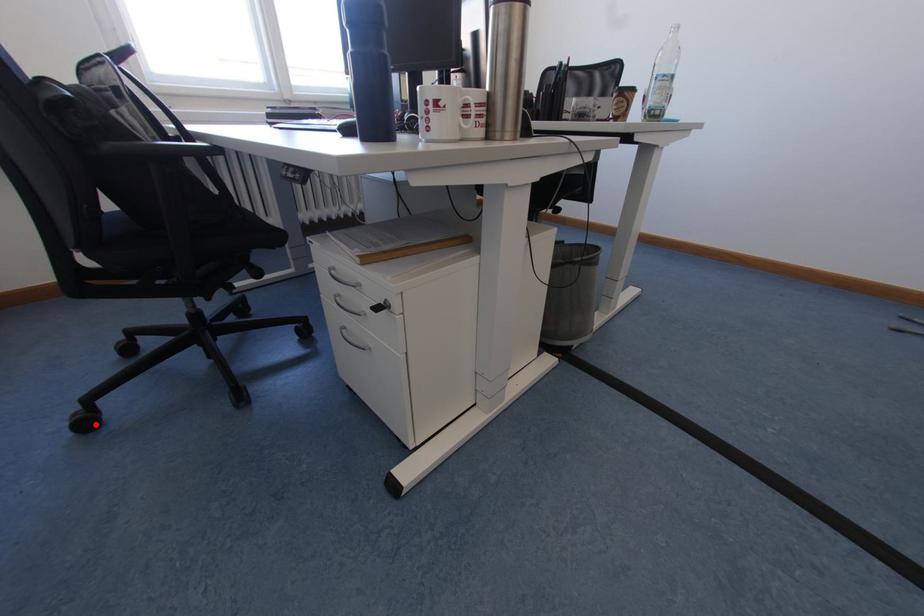
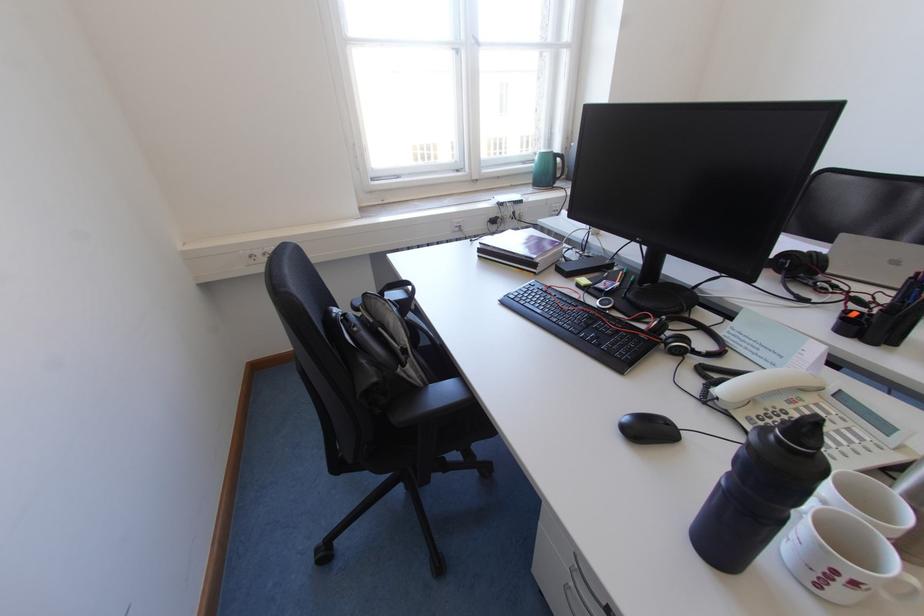
Where in the second image is the point corresponding to the highlighted location from the first image?

(333, 556)